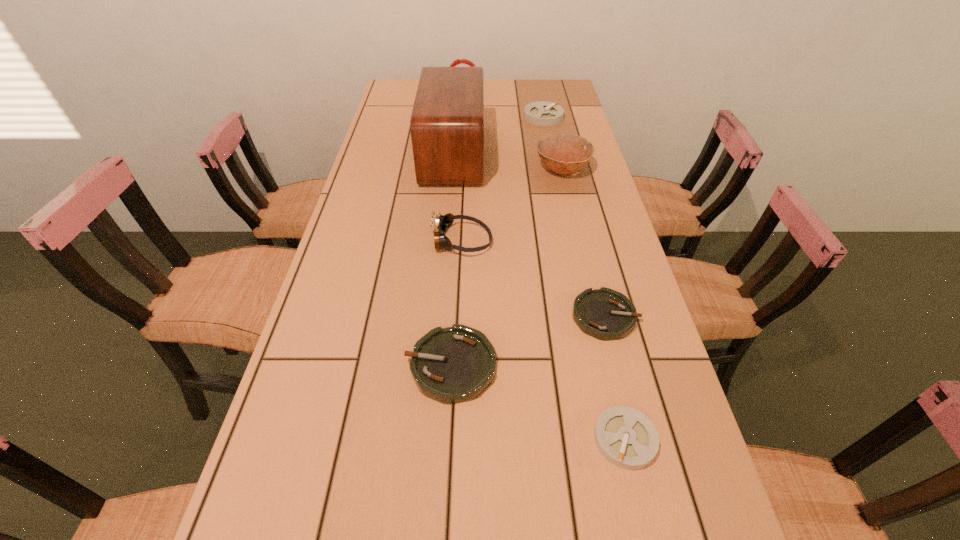
Find the location of a particular element. The height and width of the screenshot is (540, 960). the bigger green ashtray is located at coordinates (451, 365).

You are a GUI agent. You are given a task and a screenshot of the screen. Output one action in this format:
    pyautogui.click(x=<x>, y=<y>)
    Task: Click on the nearer gray ashtray
    
    Given the screenshot: What is the action you would take?
    pyautogui.click(x=627, y=438)

Image resolution: width=960 pixels, height=540 pixels. I want to click on the smaller gray ashtray, so click(x=627, y=438).

The height and width of the screenshot is (540, 960). Identify the location of the right green ashtray. (605, 314).

I want to click on vacant region located 0.270m on the front panel of the radio receiver, so click(565, 154).

Locate an element on the screen. Image resolution: width=960 pixels, height=540 pixels. vacant space located on the face of the seventh shortest object is located at coordinates (521, 89).

You are a GUI agent. You are given a task and a screenshot of the screen. Output one action in this format:
    pyautogui.click(x=<x>, y=<y>)
    Task: Click on the free location located on the left of the sixth shortest object
    The width and height of the screenshot is (960, 540).
    Given the screenshot: What is the action you would take?
    pyautogui.click(x=516, y=169)

Where is `free space located through the lenses of the fifth shortest object`? free space located through the lenses of the fifth shortest object is located at coordinates (612, 241).

This screenshot has height=540, width=960. What are the coordinates of `vacant space located 0.190m on the front of the bigger gray ashtray` in the screenshot? It's located at (551, 154).

Where is `vacant space located on the back of the bigger green ashtray`? The width and height of the screenshot is (960, 540). vacant space located on the back of the bigger green ashtray is located at coordinates (457, 254).